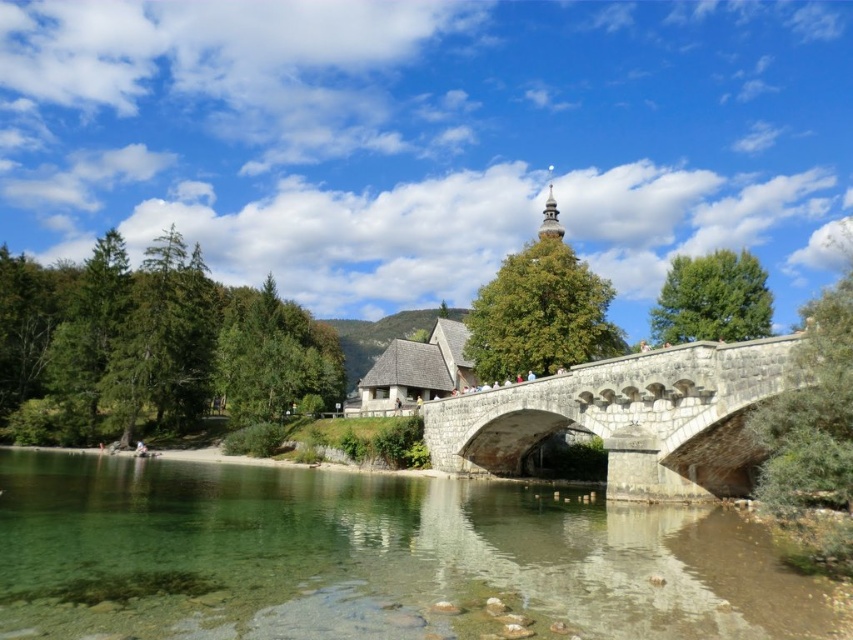
Can you confirm if clear water at river right is wider than stone bridge at center?

Correct, the width of clear water at river right exceeds that of stone bridge at center.

Is point (328, 593) positioned behind point (694, 490)?

No, it is in front of (694, 490).

Is point (442, 573) farther from viewer compared to point (521, 397)?

No, (442, 573) is closer to viewer.

This screenshot has width=853, height=640. Find the location of `clear water at river right`. clear water at river right is located at coordinates (370, 557).